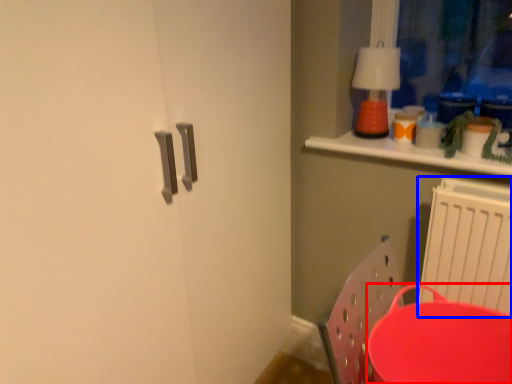
Question: Among these objects, which one is farthest to the camera, round table (highlighted by a red box) or radiator (highlighted by a blue box)?

Choices:
 (A) round table
 (B) radiator

Answer: (B)